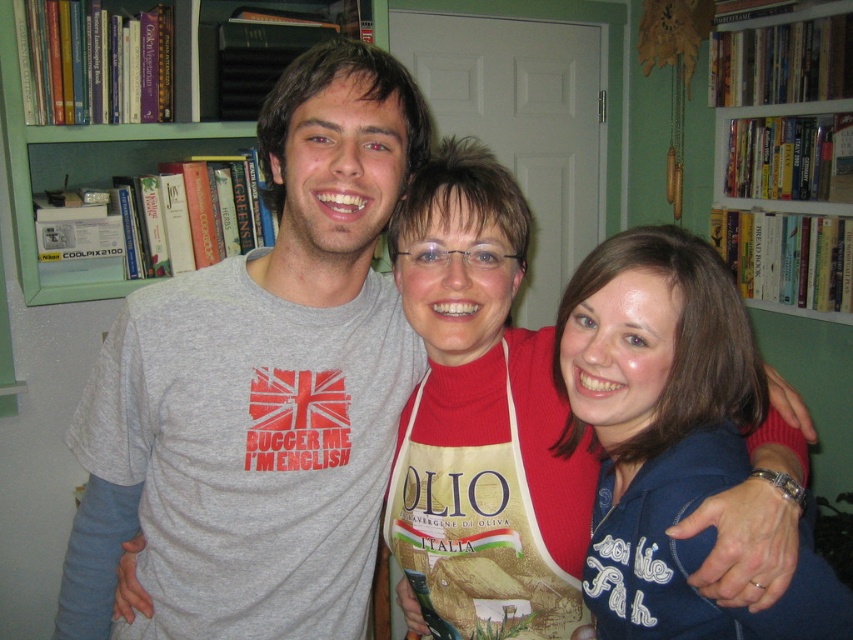
Does gray t-shirt at center have a greater width compared to white wooden bookcase at upper center?

Indeed, gray t-shirt at center has a greater width compared to white wooden bookcase at upper center.

Consider the image. Can you confirm if gray t-shirt at center is positioned above white wooden bookcase at upper center?

No.

Does point (126, 372) lie in front of point (763, 52)?

Yes.

Where is `gray t-shirt at center`? Image resolution: width=853 pixels, height=640 pixels. gray t-shirt at center is located at coordinates (260, 388).

Between point (587, 451) and point (32, 243), which one is positioned in front?

Point (587, 451) is more forward.

Consider the image. Who is more distant from viewer, (509, 273) or (4, 125)?

The point (4, 125) is more distant.

Image resolution: width=853 pixels, height=640 pixels. Identify the location of apron made of fabric at center. (480, 419).

Is gray t-shirt at center below green wood bookcase at upper left?

Yes, gray t-shirt at center is below green wood bookcase at upper left.

Is gray t-shirt at center to the right of green wood bookcase at upper left from the viewer's perspective?

Correct, you'll find gray t-shirt at center to the right of green wood bookcase at upper left.

Between point (314, 61) and point (24, 275), which one is positioned behind?

The point (24, 275) is behind.

Image resolution: width=853 pixels, height=640 pixels. In order to click on gray t-shirt at center in this screenshot , I will do `click(260, 388)`.